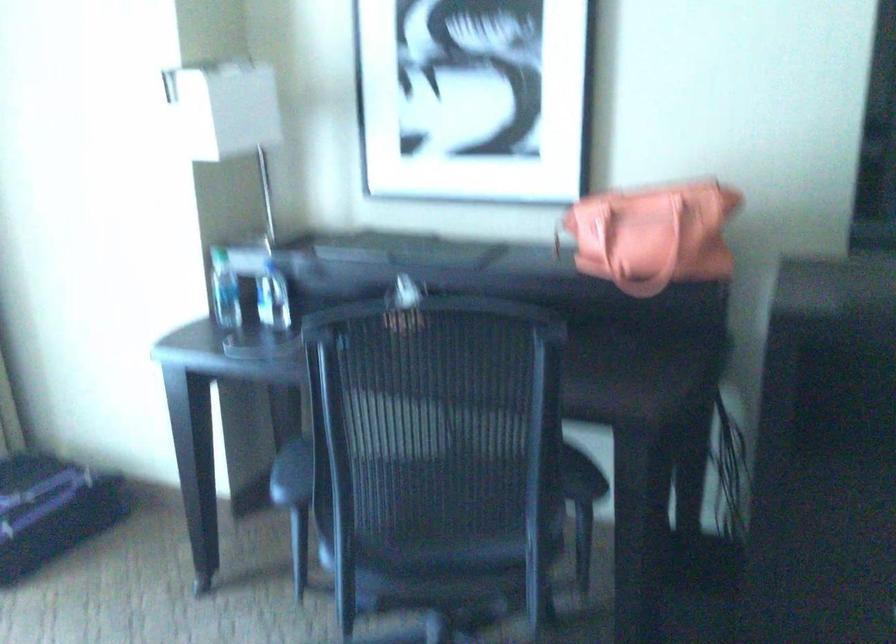
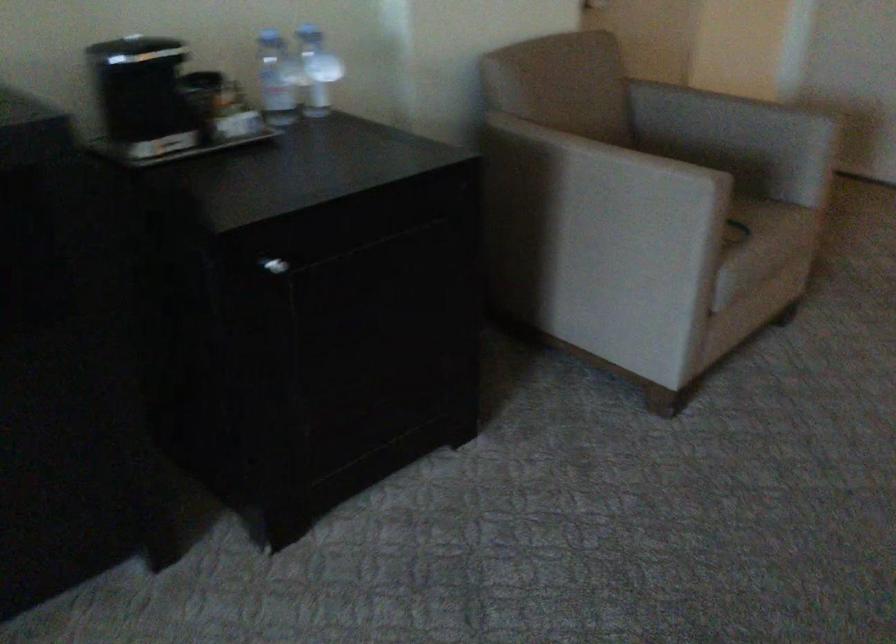
The images are taken continuously from a first-person perspective. In which direction is your viewpoint rotating?

The rotation direction of the camera is right-down.